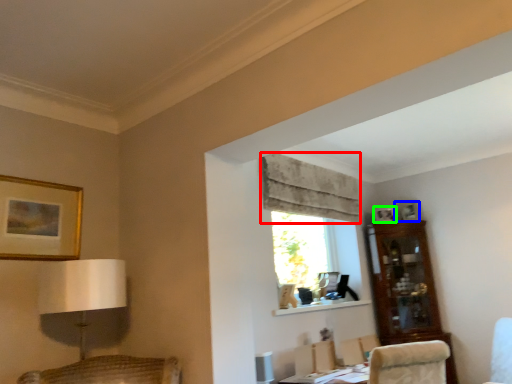
Question: Estimate the real-world distances between objects in this image. Which object is farther from curtain (highlighted by a red box), picture frame (highlighted by a blue box) or picture frame (highlighted by a green box)?

Choices:
 (A) picture frame
 (B) picture frame

Answer: (A)